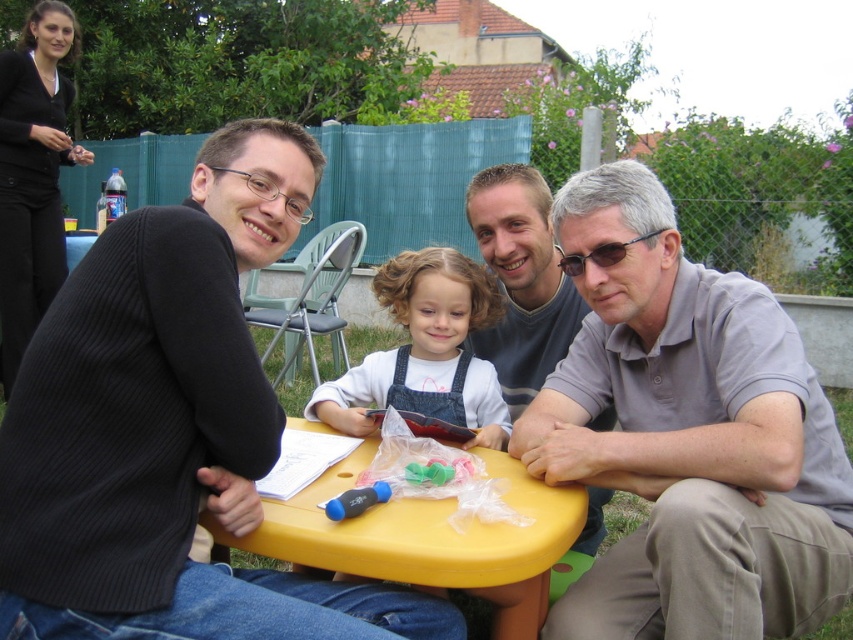
You are planning to place a rectangular book on the yellow plastic table at center. The book is as wide as the denim overalls at center. Will the book fit on the table?

The yellow plastic table at center is wider than the denim overalls at center, so the book, which is as wide as the denim overalls at center, will fit on the table.

You are standing in the backyard looking at the group around the yellow table. There are two points marked in the image. Which point, point (328,536) or point (543,292), is closer to you?

Point (328,536) is closer to the viewer than point (543,292).